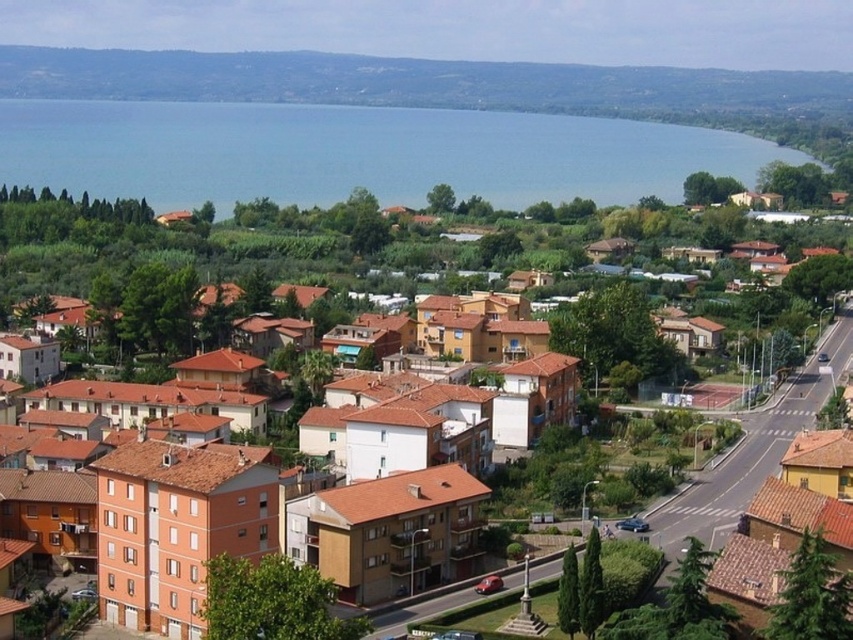
Question: Is blue water at center in front of brown brick houses at center?

Choices:
 (A) no
 (B) yes

Answer: (A)

Question: Can you confirm if blue water at center is wider than brown brick houses at center?

Choices:
 (A) yes
 (B) no

Answer: (A)

Question: In this image, where is blue water at center located relative to brown brick houses at center?

Choices:
 (A) above
 (B) below

Answer: (A)

Question: Which point is farther to the camera?

Choices:
 (A) (817, 390)
 (B) (300, 148)

Answer: (B)

Question: Which point is closer to the camera?

Choices:
 (A) brown brick houses at center
 (B) blue water at center

Answer: (A)

Question: Among these objects, which one is farthest from the camera?

Choices:
 (A) brown brick houses at center
 (B) blue water at center

Answer: (B)